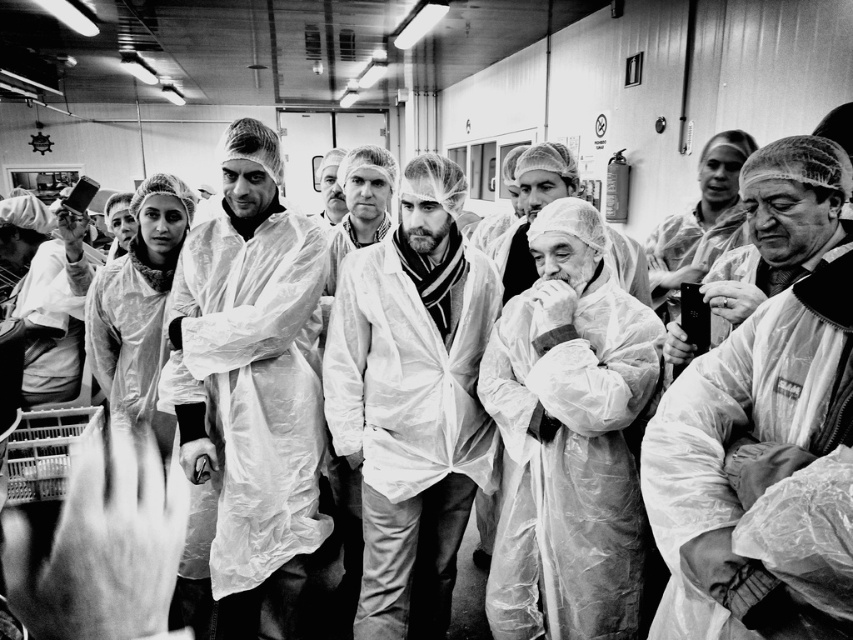
Is matte white coat at center to the left of white plastic coat at center from the viewer's perspective?

No, matte white coat at center is not to the left of white plastic coat at center.

Between matte white coat at center and white plastic coat at center, which one has more height?

white plastic coat at center

Locate an element on the screen. matte white coat at center is located at coordinates (753, 396).

The height and width of the screenshot is (640, 853). Find the location of `matte white coat at center`. matte white coat at center is located at coordinates (753, 396).

Between point (358, 460) and point (524, 545), which one is positioned behind?

Positioned behind is point (358, 460).

Identify the location of white plastic coat at center. click(x=412, y=401).

Which is behind, point (387, 420) or point (614, 564)?

Point (387, 420)

You are a GUI agent. You are given a task and a screenshot of the screen. Output one action in this format:
    pyautogui.click(x=<x>, y=<y>)
    Task: Click on the white plastic coat at center
    Image resolution: width=853 pixels, height=640 pixels.
    Given the screenshot: What is the action you would take?
    pyautogui.click(x=412, y=401)

Does matte white coat at center appear over transparent plastic coat at center?

Correct, matte white coat at center is located above transparent plastic coat at center.

Is matte white coat at center further to camera compared to transparent plastic coat at center?

No.

Who is more distant from viewer, (711, 362) or (306, 412)?

Positioned behind is point (306, 412).

Where is `matte white coat at center`? The image size is (853, 640). matte white coat at center is located at coordinates (753, 396).